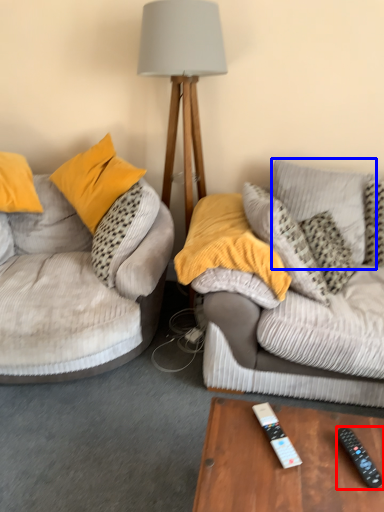
Question: Among these objects, which one is nearest to the camera, remote control (highlighted by a red box) or pillow (highlighted by a blue box)?

Choices:
 (A) remote control
 (B) pillow

Answer: (A)